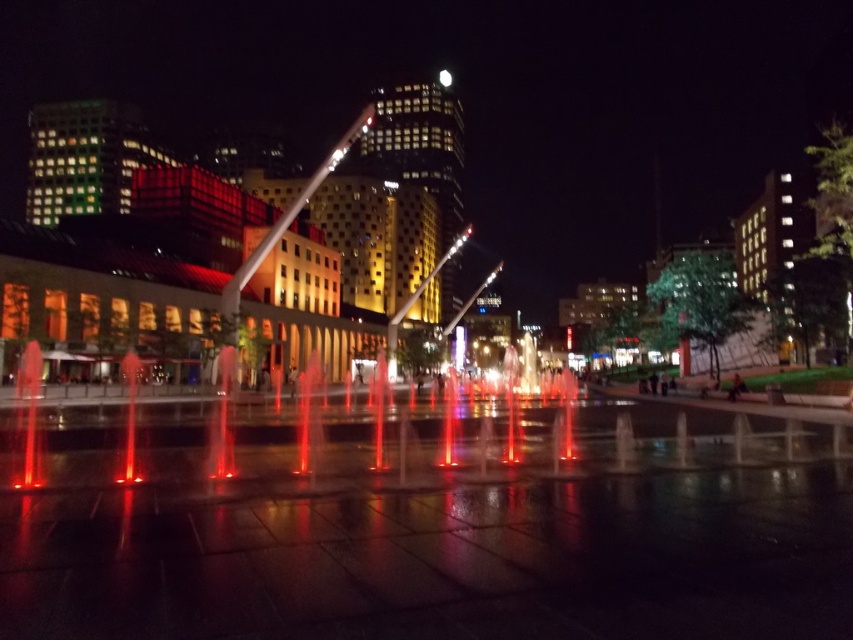
Question: Is translucent glass water jets at center closer to camera compared to white glossy pole at center?

Choices:
 (A) yes
 (B) no

Answer: (A)

Question: Which point appears closest to the camera in this image?

Choices:
 (A) (260, 248)
 (B) (747, 413)

Answer: (B)

Question: Among these objects, which one is nearest to the camera?

Choices:
 (A) white glossy pole at center
 (B) translucent glass water jets at center

Answer: (B)

Question: Can you confirm if translucent glass water jets at center is wider than white glossy pole at center?

Choices:
 (A) no
 (B) yes

Answer: (B)

Question: Is translucent glass water jets at center further to camera compared to white glossy pole at center?

Choices:
 (A) yes
 (B) no

Answer: (B)

Question: Which of the following is the farthest from the observer?

Choices:
 (A) translucent glass water jets at center
 (B) white glossy pole at center

Answer: (B)